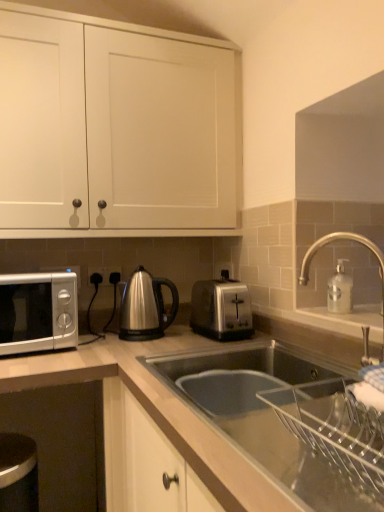
Question: Should I look upward or downward to see satin silver toaster at center?

Choices:
 (A) up
 (B) down

Answer: (B)

Question: From a real-world perspective, is satin silver toaster at center under satin silver outlet at center, placed as the second electric outlet when sorted from right to left?

Choices:
 (A) yes
 (B) no

Answer: (A)

Question: Can you confirm if satin silver toaster at center is shorter than satin silver outlet at center, placed as the second electric outlet when sorted from right to left?

Choices:
 (A) no
 (B) yes

Answer: (A)

Question: From the image's perspective, does satin silver toaster at center appear higher than satin silver outlet at center, placed as the second electric outlet when sorted from right to left?

Choices:
 (A) yes
 (B) no

Answer: (B)

Question: Can you confirm if satin silver toaster at center is positioned to the right of satin silver outlet at center, placed as the second electric outlet when sorted from right to left?

Choices:
 (A) yes
 (B) no

Answer: (A)

Question: Can you confirm if satin silver toaster at center is wider than satin silver outlet at center, which is the 1th electric outlet in left-to-right order?

Choices:
 (A) yes
 (B) no

Answer: (A)

Question: Does satin silver toaster at center have a smaller size compared to satin silver outlet at center, which is the 1th electric outlet in left-to-right order?

Choices:
 (A) no
 (B) yes

Answer: (A)

Question: Does satin silver outlet at center, which is the 1th electric outlet in left-to-right order, have a lesser height compared to satin silver outlet at center, which is the second electric outlet in left-to-right order?

Choices:
 (A) yes
 (B) no

Answer: (B)

Question: Is the depth of satin silver outlet at center, which is the 1th electric outlet in left-to-right order, greater than that of satin silver outlet at center, which is the 1th electric outlet in right-to-left order?

Choices:
 (A) no
 (B) yes

Answer: (A)

Question: Is the position of satin silver outlet at center, which is the 1th electric outlet in left-to-right order, less distant than that of satin silver outlet at center, which is the 1th electric outlet in right-to-left order?

Choices:
 (A) no
 (B) yes

Answer: (B)

Question: From a real-world perspective, is satin silver outlet at center, placed as the second electric outlet when sorted from right to left, under satin silver outlet at center, which is the 1th electric outlet in right-to-left order?

Choices:
 (A) yes
 (B) no

Answer: (A)

Question: Considering the relative sizes of satin silver outlet at center, which is the 1th electric outlet in left-to-right order, and satin silver outlet at center, which is the second electric outlet in left-to-right order, in the image provided, is satin silver outlet at center, which is the 1th electric outlet in left-to-right order, taller than satin silver outlet at center, which is the second electric outlet in left-to-right order,?

Choices:
 (A) yes
 (B) no

Answer: (A)

Question: Is satin silver outlet at center, which is the 1th electric outlet in left-to-right order, thinner than satin silver outlet at center, which is the 1th electric outlet in right-to-left order?

Choices:
 (A) no
 (B) yes

Answer: (A)

Question: Considering the relative sizes of white matte cabinet doors at upper center and stainless steel kettle at center in the image provided, is white matte cabinet doors at upper center taller than stainless steel kettle at center?

Choices:
 (A) yes
 (B) no

Answer: (A)